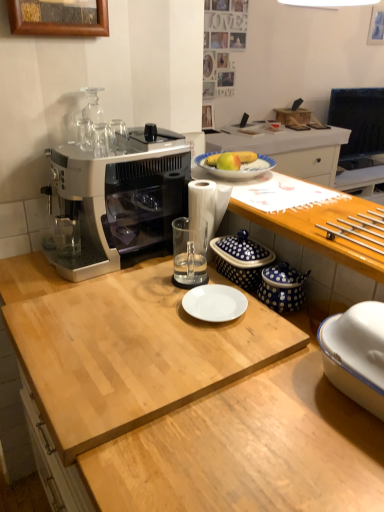
This screenshot has height=512, width=384. In order to click on vacant area situated to the left side of transparent glass at center, the 2th tableware positioned from the left in this screenshot , I will do `click(135, 286)`.